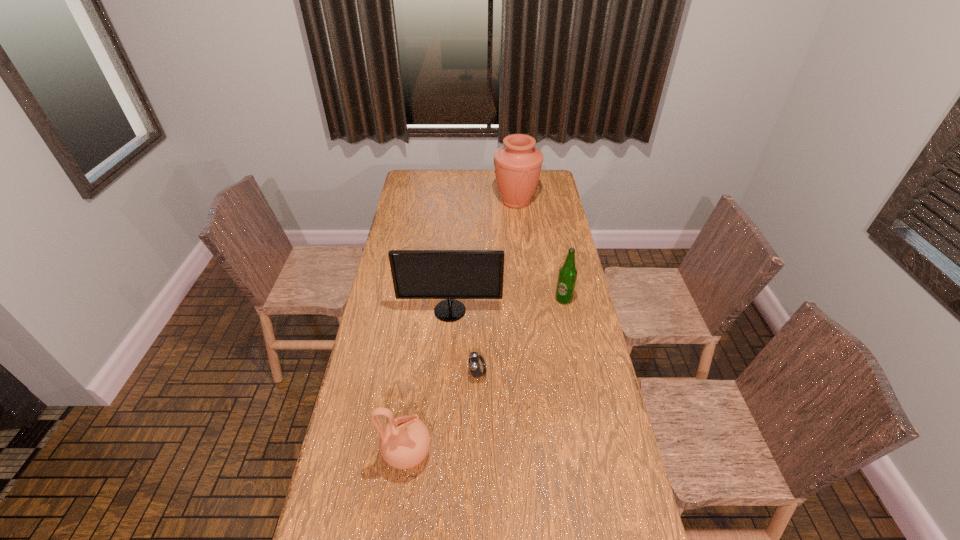
At what (x,y) coordinates should I click in order to perform the action: click on free space between the computer monitor and the alarm clock. Please return your answer as a coordinate pair (x, y). The height and width of the screenshot is (540, 960). Looking at the image, I should click on (464, 342).

This screenshot has width=960, height=540. I want to click on vacant space that's between the shortest object and the pottery, so click(443, 413).

This screenshot has height=540, width=960. Find the location of `free spot between the computer monitor and the pottery`. free spot between the computer monitor and the pottery is located at coordinates (428, 382).

Locate an element on the screen. The height and width of the screenshot is (540, 960). vacant area that lies between the nearest object and the beer bottle is located at coordinates (486, 376).

Where is `vacant region between the pottery and the computer monitor`? The width and height of the screenshot is (960, 540). vacant region between the pottery and the computer monitor is located at coordinates (428, 382).

This screenshot has height=540, width=960. What are the coordinates of `unoccupied area between the pottery and the farthest object` in the screenshot? It's located at (462, 327).

At what (x,y) coordinates should I click in order to perform the action: click on vacant space that is in between the computer monitor and the shortest object. Please return your answer as a coordinate pair (x, y). This screenshot has height=540, width=960. Looking at the image, I should click on (464, 342).

In order to click on free spot between the vase and the nearest object in this screenshot , I will do coord(462,327).

Identify the location of object that is the fourth closest to the computer monitor. (518, 163).

Select which object is the closest to the beer bottle. Please provide its 2D coordinates. Your answer should be formatted as a tuple, i.e. [(x, y)], where the tuple contains the x and y coordinates of a point satisfying the conditions above.

[(417, 274)]